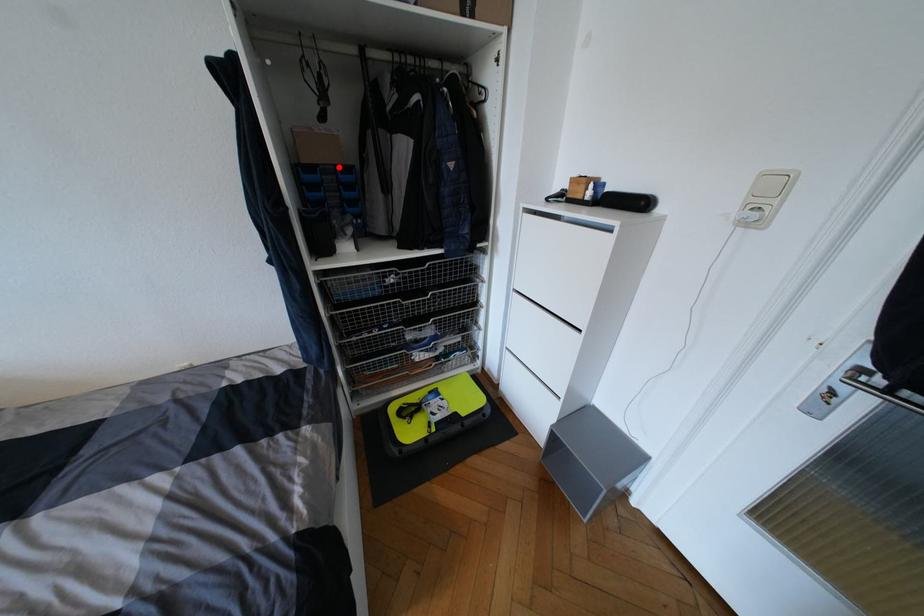
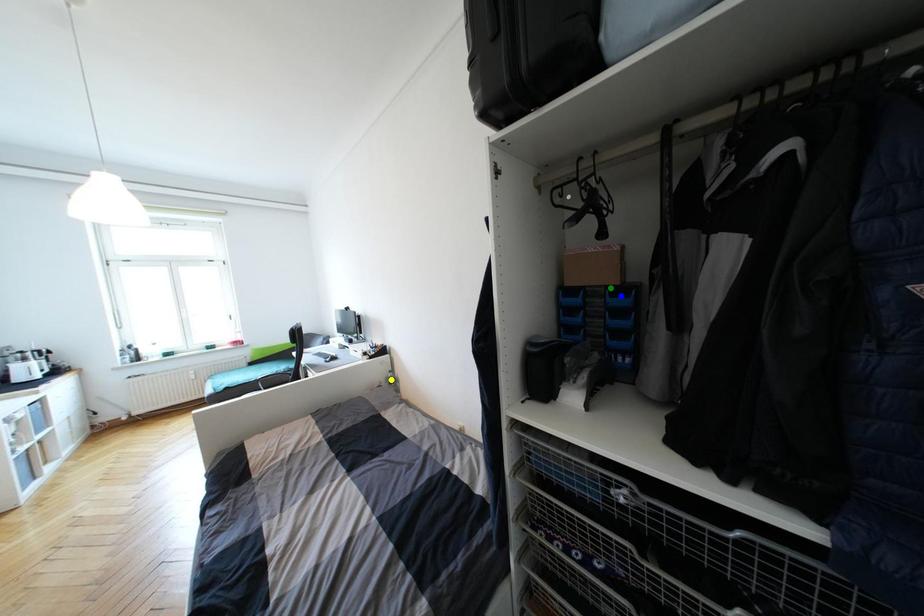
Question: I am providing you with two images of the same scene from different viewpoints. A red point is marked on the first image. You are given multiple points on the second image. Which point in image 2 is actually the same real-world point as the red point in image 1?

Choices:
 (A) blue point
 (B) green point
 (C) yellow point

Answer: (B)